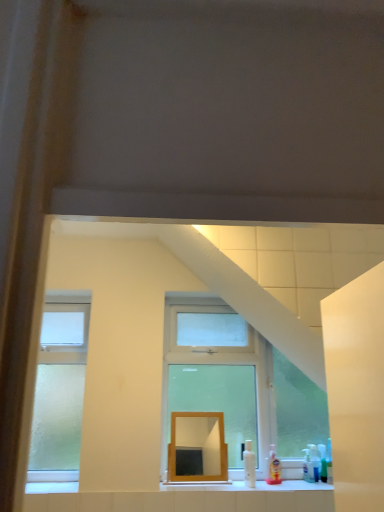
The image size is (384, 512). What do you see at coordinates (237, 384) in the screenshot?
I see `clear glass window at center` at bounding box center [237, 384].

Measure the distance between wooden mirror at center and camera.

wooden mirror at center and camera are 7.40 feet apart.

Describe the element at coordinates (273, 468) in the screenshot. The image size is (384, 512). I see `translucent plastic soap dispenser at lower right, marked as the 1th toiletry in a left-to-right arrangement` at that location.

What is the approximate width of translucent plastic spray bottle at lower right, arranged as the second toiletry when viewed from the left?

3.26 inches.

The height and width of the screenshot is (512, 384). What do you see at coordinates (314, 463) in the screenshot?
I see `translucent plastic spray bottle at lower right, the 1th toiletry in the right-to-left sequence` at bounding box center [314, 463].

Image resolution: width=384 pixels, height=512 pixels. I want to click on clear glass window at center, so click(237, 384).

From the image's perspective, which is above, translucent plastic spray bottle at lower right, arranged as the second toiletry when viewed from the left, or translucent plastic soap dispenser at lower right, marked as the 1th toiletry in a left-to-right arrangement?

translucent plastic soap dispenser at lower right, marked as the 1th toiletry in a left-to-right arrangement.

Is translucent plastic spray bottle at lower right, arranged as the second toiletry when viewed from the left, shorter than translucent plastic soap dispenser at lower right, positioned as the second toiletry in right-to-left order?

Yes.

From a real-world perspective, which is physically above, translucent plastic spray bottle at lower right, the 1th toiletry in the right-to-left sequence, or translucent plastic soap dispenser at lower right, positioned as the second toiletry in right-to-left order?

translucent plastic soap dispenser at lower right, positioned as the second toiletry in right-to-left order, from a real-world perspective.

This screenshot has width=384, height=512. Find the location of `toiletry above the translucent plastic spray bottle at lower right, arranged as the second toiletry when viewed from the left (from a real-world perspective)`. toiletry above the translucent plastic spray bottle at lower right, arranged as the second toiletry when viewed from the left (from a real-world perspective) is located at coordinates pyautogui.click(x=273, y=468).

Which is in front, point (198, 444) or point (203, 452)?

The point (203, 452) is closer.

Between wooden mirror at center and clear glass window at center, which one has larger width?

With larger width is clear glass window at center.

Considering the relative positions of wooden mirror at center and clear glass window at center in the image provided, is wooden mirror at center to the right of clear glass window at center from the viewer's perspective?

Incorrect, wooden mirror at center is not on the right side of clear glass window at center.

Which of these two, clear glass window at center or translucent plastic soap dispenser at lower right, marked as the 1th toiletry in a left-to-right arrangement, is smaller?

With smaller size is translucent plastic soap dispenser at lower right, marked as the 1th toiletry in a left-to-right arrangement.

Does point (216, 352) lie behind point (277, 470)?

Yes, it is behind point (277, 470).

Measure the distance from clear glass window at center to translucent plastic soap dispenser at lower right, marked as the 1th toiletry in a left-to-right arrangement.

clear glass window at center is 17.66 inches from translucent plastic soap dispenser at lower right, marked as the 1th toiletry in a left-to-right arrangement.

Do you think clear glass window at center is within translucent plastic soap dispenser at lower right, marked as the 1th toiletry in a left-to-right arrangement, or outside of it?

clear glass window at center is located beyond the bounds of translucent plastic soap dispenser at lower right, marked as the 1th toiletry in a left-to-right arrangement.

There is a wooden mirror at center. Find the location of `the 2nd toiletry below it (from a real-world perspective)`. the 2nd toiletry below it (from a real-world perspective) is located at coordinates (314, 463).

Is translucent plastic spray bottle at lower right, arranged as the second toiletry when viewed from the left, aimed at wooden mirror at center?

No, translucent plastic spray bottle at lower right, arranged as the second toiletry when viewed from the left, is not aimed at wooden mirror at center.

From the picture: Who is more distant, translucent plastic spray bottle at lower right, the 1th toiletry in the right-to-left sequence, or wooden mirror at center?

translucent plastic spray bottle at lower right, the 1th toiletry in the right-to-left sequence.

Could you tell me if translucent plastic soap dispenser at lower right, marked as the 1th toiletry in a left-to-right arrangement, is facing clear glass window at center?

No, translucent plastic soap dispenser at lower right, marked as the 1th toiletry in a left-to-right arrangement, does not turn towards clear glass window at center.

From the image's perspective, relative to clear glass window at center, is translucent plastic soap dispenser at lower right, marked as the 1th toiletry in a left-to-right arrangement, above or below?

Based on their image positions, translucent plastic soap dispenser at lower right, marked as the 1th toiletry in a left-to-right arrangement, is located beneath clear glass window at center.

How different are the orientations of translucent plastic soap dispenser at lower right, marked as the 1th toiletry in a left-to-right arrangement, and clear glass window at center in degrees?

The angular difference between translucent plastic soap dispenser at lower right, marked as the 1th toiletry in a left-to-right arrangement, and clear glass window at center is 0.759 degrees.

Between translucent plastic soap dispenser at lower right, marked as the 1th toiletry in a left-to-right arrangement, and clear glass window at center, which one has larger width?

clear glass window at center.

This screenshot has width=384, height=512. I want to click on mirror in front of the clear glass window at center, so click(201, 439).

How different are the orientations of clear glass window at center and wooden mirror at center in degrees?

There is a 0.426-degree angle between the facing directions of clear glass window at center and wooden mirror at center.

Between clear glass window at center and wooden mirror at center, which one appears on the right side from the viewer's perspective?

clear glass window at center.

From the image's perspective, is clear glass window at center below wooden mirror at center?

Actually, clear glass window at center appears above wooden mirror at center in the image.

In the image, is wooden mirror at center positioned in front of or behind translucent plastic spray bottle at lower right, arranged as the second toiletry when viewed from the left?

In the image, wooden mirror at center appears in front of translucent plastic spray bottle at lower right, arranged as the second toiletry when viewed from the left.

Is wooden mirror at center oriented towards translucent plastic spray bottle at lower right, arranged as the second toiletry when viewed from the left?

No, wooden mirror at center is not aimed at translucent plastic spray bottle at lower right, arranged as the second toiletry when viewed from the left.

Which object is positioned more to the right, wooden mirror at center or translucent plastic spray bottle at lower right, arranged as the second toiletry when viewed from the left?

Positioned to the right is translucent plastic spray bottle at lower right, arranged as the second toiletry when viewed from the left.

At what (x,y) coordinates should I click in order to perform the action: click on the 2nd toiletry positioned below the wooden mirror at center (from the image's perspective). Please return your answer as a coordinate pair (x, y). The height and width of the screenshot is (512, 384). Looking at the image, I should click on (314, 463).

Find the location of a particular element. toiletry on the left of translucent plastic spray bottle at lower right, the 1th toiletry in the right-to-left sequence is located at coordinates coord(273,468).

You are a GUI agent. You are given a task and a screenshot of the screen. Output one action in this format:
    pyautogui.click(x=<x>, y=<y>)
    Task: Click on the window that appears on the right of wooden mirror at center
    Image resolution: width=384 pixels, height=512 pixels.
    Given the screenshot: What is the action you would take?
    pyautogui.click(x=237, y=384)

Estimate the real-world distances between objects in this image. Which object is further from wooden mirror at center, clear glass window at center or translucent plastic spray bottle at lower right, the 1th toiletry in the right-to-left sequence?

translucent plastic spray bottle at lower right, the 1th toiletry in the right-to-left sequence, lies further to wooden mirror at center than the other object.

Based on their spatial positions, is clear glass window at center or translucent plastic spray bottle at lower right, the 1th toiletry in the right-to-left sequence, closer to translucent plastic soap dispenser at lower right, marked as the 1th toiletry in a left-to-right arrangement?

Among the two, translucent plastic spray bottle at lower right, the 1th toiletry in the right-to-left sequence, is located nearer to translucent plastic soap dispenser at lower right, marked as the 1th toiletry in a left-to-right arrangement.

Which object lies further to the anchor point translucent plastic spray bottle at lower right, the 1th toiletry in the right-to-left sequence, wooden mirror at center or clear glass window at center?

The object further to translucent plastic spray bottle at lower right, the 1th toiletry in the right-to-left sequence, is wooden mirror at center.

Considering their positions, is translucent plastic soap dispenser at lower right, marked as the 1th toiletry in a left-to-right arrangement, positioned closer to wooden mirror at center than clear glass window at center?

Based on the image, clear glass window at center appears to be nearer to wooden mirror at center.

When comparing their distances from translucent plastic spray bottle at lower right, the 1th toiletry in the right-to-left sequence, does translucent plastic soap dispenser at lower right, positioned as the second toiletry in right-to-left order, or wooden mirror at center seem further?

wooden mirror at center lies further to translucent plastic spray bottle at lower right, the 1th toiletry in the right-to-left sequence, than the other object.

Looking at the image, which one is located closer to translucent plastic soap dispenser at lower right, marked as the 1th toiletry in a left-to-right arrangement, clear glass window at center or wooden mirror at center?

The object closer to translucent plastic soap dispenser at lower right, marked as the 1th toiletry in a left-to-right arrangement, is wooden mirror at center.

From the image, which object appears to be nearer to wooden mirror at center, translucent plastic soap dispenser at lower right, marked as the 1th toiletry in a left-to-right arrangement, or translucent plastic spray bottle at lower right, arranged as the second toiletry when viewed from the left?

translucent plastic soap dispenser at lower right, marked as the 1th toiletry in a left-to-right arrangement, is closer to wooden mirror at center.

Considering their positions, is translucent plastic soap dispenser at lower right, marked as the 1th toiletry in a left-to-right arrangement, positioned further to clear glass window at center than wooden mirror at center?

translucent plastic soap dispenser at lower right, marked as the 1th toiletry in a left-to-right arrangement, is further to clear glass window at center.

You are a GUI agent. You are given a task and a screenshot of the screen. Output one action in this format:
    pyautogui.click(x=<x>, y=<y>)
    Task: Click on the window between wooden mirror at center and translucent plastic soap dispenser at lower right, positioned as the second toiletry in right-to-left order, in the horizontal direction
    
    Given the screenshot: What is the action you would take?
    pyautogui.click(x=237, y=384)

Locate an element on the screen. This screenshot has width=384, height=512. window located between wooden mirror at center and translucent plastic spray bottle at lower right, the 1th toiletry in the right-to-left sequence, in the left-right direction is located at coordinates (237, 384).

Where is `toiletry between clear glass window at center and translucent plastic spray bottle at lower right, arranged as the second toiletry when viewed from the left, in the vertical direction`? This screenshot has height=512, width=384. toiletry between clear glass window at center and translucent plastic spray bottle at lower right, arranged as the second toiletry when viewed from the left, in the vertical direction is located at coordinates (273, 468).

You are a GUI agent. You are given a task and a screenshot of the screen. Output one action in this format:
    pyautogui.click(x=<x>, y=<y>)
    Task: Click on the toiletry located between wooden mirror at center and translucent plastic spray bottle at lower right, arranged as the second toiletry when viewed from the left, in the left-right direction
    The width and height of the screenshot is (384, 512).
    Given the screenshot: What is the action you would take?
    pyautogui.click(x=273, y=468)